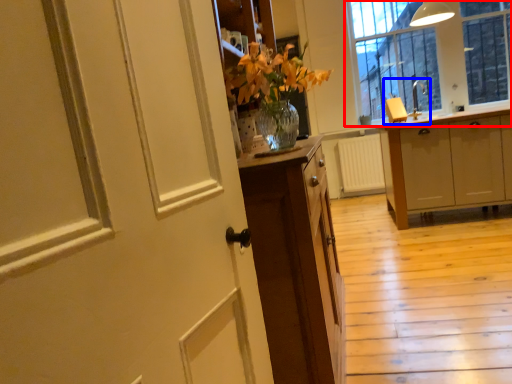
Question: Among these objects, which one is nearest to the camera, window (highlighted by a red box) or sink (highlighted by a blue box)?

Choices:
 (A) window
 (B) sink

Answer: (B)